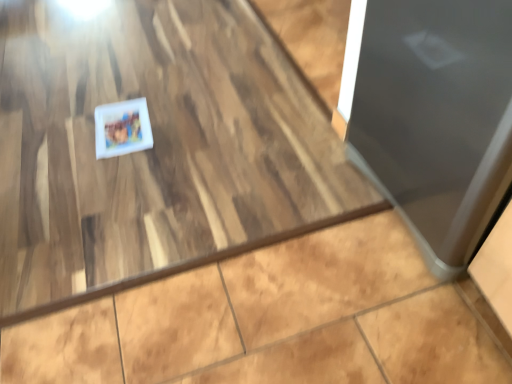
Identify the location of vacant space underneath glossy metallic door at right (from a real-world perspective). The height and width of the screenshot is (384, 512). (394, 213).